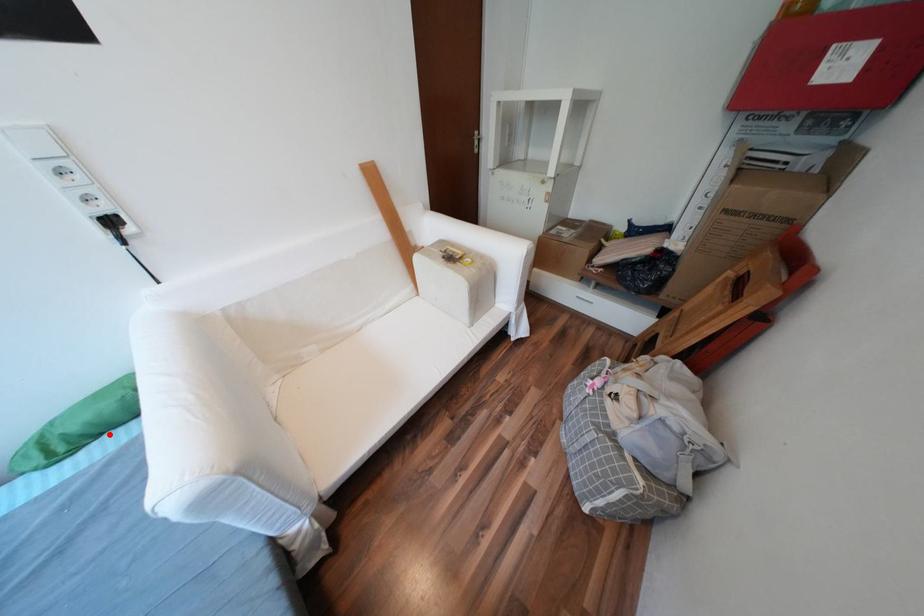
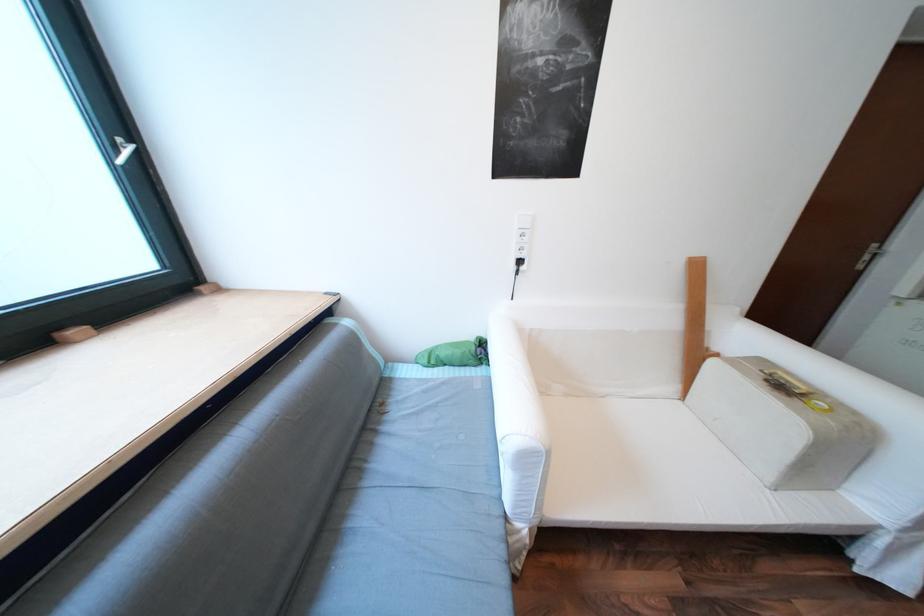
Question: I am providing you with two images of the same scene from different viewpoints. In image1, a red point is highlighted. Considering the same 3D point in image2, which of the following is correct?

Choices:
 (A) It is closer
 (B) It is farther

Answer: (B)